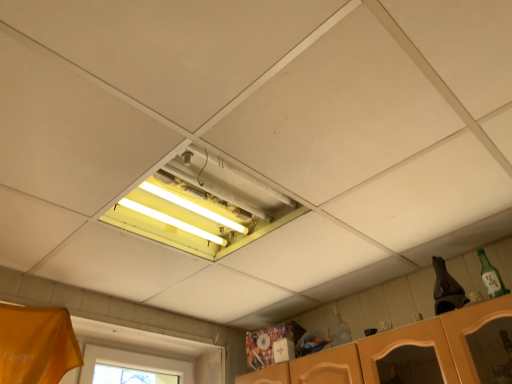
The image size is (512, 384). Describe the element at coordinates (203, 207) in the screenshot. I see `yellow fluorescent light at center` at that location.

Measure the distance between point (188, 238) and camera.

They are 1.85 meters apart.

I want to click on yellow fluorescent light at center, so click(x=203, y=207).

Where is `green glass bottle at upper right`? green glass bottle at upper right is located at coordinates (490, 277).

What is the approximate width of green glass bottle at upper right?

The width of green glass bottle at upper right is 3.01 inches.

Measure the distance between point (484, 275) and camera.

They are 1.64 meters apart.

The image size is (512, 384). What do you see at coordinates (490, 277) in the screenshot? I see `green glass bottle at upper right` at bounding box center [490, 277].

What are the coordinates of `yellow fluorescent light at center` in the screenshot? It's located at (203, 207).

Which is more to the right, green glass bottle at upper right or yellow fluorescent light at center?

green glass bottle at upper right is more to the right.

Which object is further away from the camera, green glass bottle at upper right or yellow fluorescent light at center?

green glass bottle at upper right is further away from the camera.

Which is nearer, (486, 278) or (244, 208)?

Clearly, point (486, 278) is closer to the camera than point (244, 208).

From the image's perspective, between green glass bottle at upper right and yellow fluorescent light at center, who is located below?

green glass bottle at upper right.

From a real-world perspective, which object stands above the other?

From a 3D spatial view, yellow fluorescent light at center is above.

Can you confirm if green glass bottle at upper right is thinner than yellow fluorescent light at center?

Indeed, green glass bottle at upper right has a lesser width compared to yellow fluorescent light at center.

Considering the sizes of objects green glass bottle at upper right and yellow fluorescent light at center in the image provided, who is taller, green glass bottle at upper right or yellow fluorescent light at center?

Standing taller between the two is green glass bottle at upper right.

Who is smaller, green glass bottle at upper right or yellow fluorescent light at center?

With smaller size is green glass bottle at upper right.

Consider the image. Would you say green glass bottle at upper right is inside or outside yellow fluorescent light at center?

green glass bottle at upper right is not enclosed by yellow fluorescent light at center.

Is green glass bottle at upper right next to yellow fluorescent light at center?

green glass bottle at upper right and yellow fluorescent light at center are not in contact.

Is green glass bottle at upper right oriented towards yellow fluorescent light at center?

No.

Locate an element on the screen. window that appears on the left of green glass bottle at upper right is located at coordinates (203, 207).

Is yellow fluorescent light at center to the left of green glass bottle at upper right from the viewer's perspective?

Yes, yellow fluorescent light at center is to the left of green glass bottle at upper right.

Which object is more forward, yellow fluorescent light at center or green glass bottle at upper right?

yellow fluorescent light at center is closer to the camera.

Which is behind, point (160, 182) or point (482, 267)?

Point (482, 267)

From the image's perspective, would you say yellow fluorescent light at center is positioned over green glass bottle at upper right?

Yes, from the image's perspective, yellow fluorescent light at center is on top of green glass bottle at upper right.

From a real-world perspective, who is located lower, yellow fluorescent light at center or green glass bottle at upper right?

From a 3D spatial view, green glass bottle at upper right is below.

Looking at their sizes, would you say yellow fluorescent light at center is wider or thinner than green glass bottle at upper right?

Considering their sizes, yellow fluorescent light at center looks broader than green glass bottle at upper right.

Who is taller, yellow fluorescent light at center or green glass bottle at upper right?

With more height is green glass bottle at upper right.

Looking at this image, who is smaller, yellow fluorescent light at center or green glass bottle at upper right?

With smaller size is green glass bottle at upper right.

Is green glass bottle at upper right completely or partially inside yellow fluorescent light at center?

No, green glass bottle at upper right is located outside of yellow fluorescent light at center.

Are yellow fluorescent light at center and green glass bottle at upper right beside each other?

No, yellow fluorescent light at center is not touching green glass bottle at upper right.

Is yellow fluorescent light at center positioned with its back to green glass bottle at upper right?

That's not correct — yellow fluorescent light at center is not looking away from green glass bottle at upper right.

The height and width of the screenshot is (384, 512). Find the location of `bottle that appears behind the yellow fluorescent light at center`. bottle that appears behind the yellow fluorescent light at center is located at coordinates (490, 277).

The width and height of the screenshot is (512, 384). Find the location of `bottle that appears behind the yellow fluorescent light at center`. bottle that appears behind the yellow fluorescent light at center is located at coordinates (490, 277).

The image size is (512, 384). What are the coordinates of `window lying in front of the green glass bottle at upper right` in the screenshot? It's located at (203, 207).